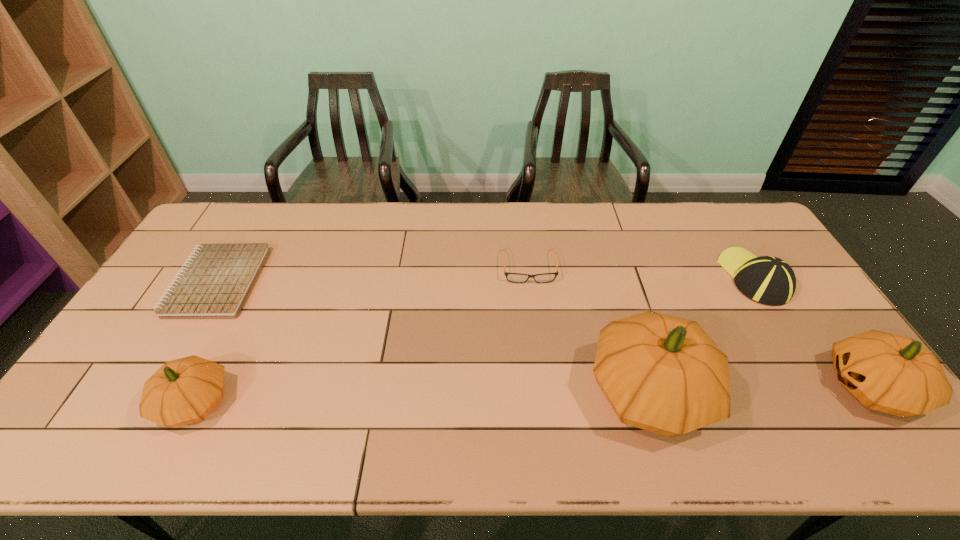
Image resolution: width=960 pixels, height=540 pixels. In order to click on vacant area between the shortest object and the rightmost gourd in this screenshot , I will do `click(543, 335)`.

At what (x,y) coordinates should I click in order to perform the action: click on vacant space in between the second tallest object and the shortest gourd. Please return your answer as a coordinate pair (x, y). The image size is (960, 540). Looking at the image, I should click on (533, 395).

You are a GUI agent. You are given a task and a screenshot of the screen. Output one action in this format:
    pyautogui.click(x=<x>, y=<y>)
    Task: Click on the free spot between the third tallest object and the baseball cap
    This screenshot has height=540, width=960.
    Given the screenshot: What is the action you would take?
    pyautogui.click(x=474, y=340)

At what (x,y) coordinates should I click in order to perform the action: click on empty space between the fourth object from right to left and the tallest object. Please return your answer as a coordinate pair (x, y). This screenshot has height=540, width=960. Looking at the image, I should click on (589, 329).

Locate an element on the screen. This screenshot has width=960, height=540. vacant space that's between the fourth shortest object and the tallest object is located at coordinates (422, 397).

Identify the location of free area in between the rightmost gourd and the notebook. This screenshot has height=540, width=960. (543, 335).

At what (x,y) coordinates should I click in order to perform the action: click on free space that is in between the notebook and the third object from left to right. Please return your answer as a coordinate pair (x, y). Looking at the image, I should click on (372, 274).

Locate an element on the screen. vacant area that lies between the shortest object and the baseball cap is located at coordinates (486, 280).

I want to click on the second closest object to the second gourd from left to right, so click(x=769, y=280).

This screenshot has height=540, width=960. I want to click on object that is the fifth closest to the shortest gourd, so click(x=894, y=374).